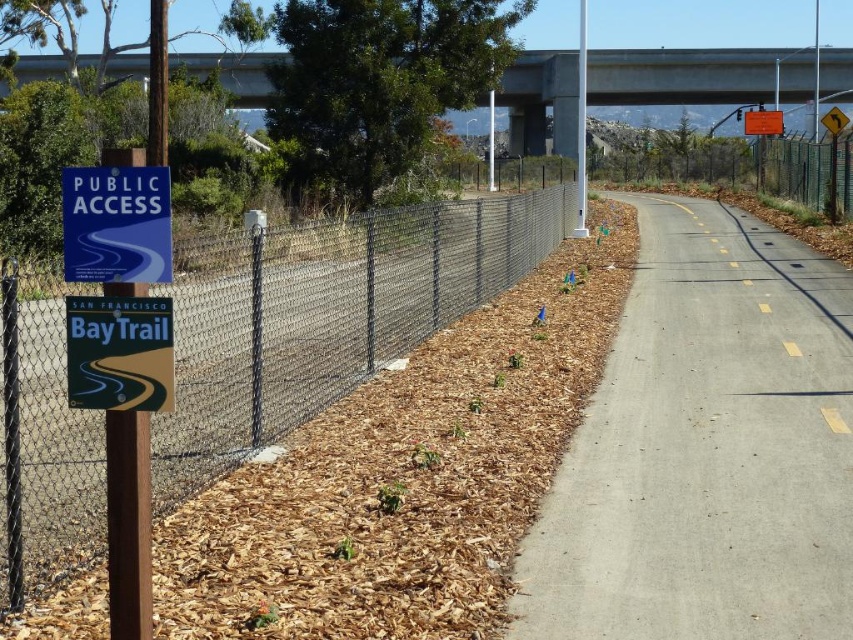
You are walking along the Bay Trail and notice the concrete at upper center and the green plastic sign at left. Which object is closer to you as you walk along the path?

The concrete at upper center is closer to you because it is further to the viewer than the green plastic sign at left, meaning it appears nearer in your line of sight.